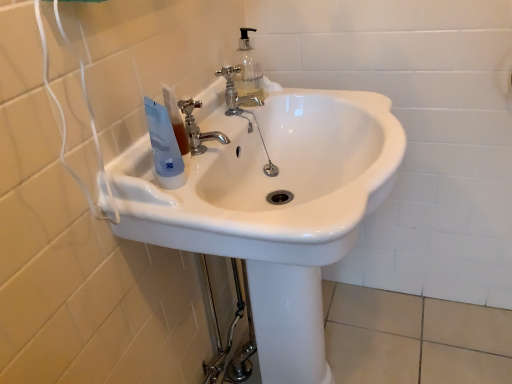
Question: Can you confirm if white glossy sink at center is bigger than chrome metallic faucet at center, which is the first tap from front to back?

Choices:
 (A) no
 (B) yes

Answer: (B)

Question: Is white glossy sink at center facing away from chrome metallic faucet at center, which is the first tap from front to back?

Choices:
 (A) no
 (B) yes

Answer: (A)

Question: Considering the relative sizes of white glossy sink at center and chrome metallic faucet at center, which ranks as the second tap in back-to-front order, in the image provided, is white glossy sink at center wider than chrome metallic faucet at center, which ranks as the second tap in back-to-front order,?

Choices:
 (A) yes
 (B) no

Answer: (A)

Question: Can you confirm if white glossy sink at center is positioned to the right of chrome metallic faucet at center, acting as the second tap starting from the top?

Choices:
 (A) no
 (B) yes

Answer: (B)

Question: Is white glossy sink at center touching chrome metallic faucet at center, placed as the first tap when sorted from bottom to top?

Choices:
 (A) yes
 (B) no

Answer: (B)

Question: Is white plastic bottle at upper left taller or shorter than chrome metallic faucet at center, which ranks as the second tap in back-to-front order?

Choices:
 (A) short
 (B) tall

Answer: (A)

Question: Looking at the image, does white plastic bottle at upper left seem bigger or smaller compared to chrome metallic faucet at center, which ranks as the first tap in left-to-right order?

Choices:
 (A) big
 (B) small

Answer: (B)

Question: Is white plastic bottle at upper left in front of or behind chrome metallic faucet at center, acting as the second tap starting from the right, in the image?

Choices:
 (A) behind
 (B) front

Answer: (B)

Question: Based on their positions, is white plastic bottle at upper left located to the left or right of chrome metallic faucet at center, which is the first tap from front to back?

Choices:
 (A) right
 (B) left

Answer: (B)

Question: Is white plastic bottle at upper left inside or outside of chrome metallic faucet at upper center, which appears as the 1th tap when viewed from the back?

Choices:
 (A) outside
 (B) inside

Answer: (A)

Question: Based on their positions, is white plastic bottle at upper left located to the left or right of chrome metallic faucet at upper center, which is the first tap in right-to-left order?

Choices:
 (A) left
 (B) right

Answer: (A)

Question: From a real-world perspective, is white plastic bottle at upper left physically located above or below chrome metallic faucet at upper center, positioned as the 2th tap in front-to-back order?

Choices:
 (A) above
 (B) below

Answer: (A)

Question: From the image's perspective, relative to chrome metallic faucet at upper center, which appears as the 1th tap when viewed from the back, is white plastic bottle at upper left above or below?

Choices:
 (A) below
 (B) above

Answer: (A)

Question: From a real-world perspective, is white plastic bottle at upper left above or below blue plastic tube at upper left?

Choices:
 (A) above
 (B) below

Answer: (B)

Question: Does point (179, 132) appear closer or farther from the camera than point (157, 178)?

Choices:
 (A) closer
 (B) farther

Answer: (B)